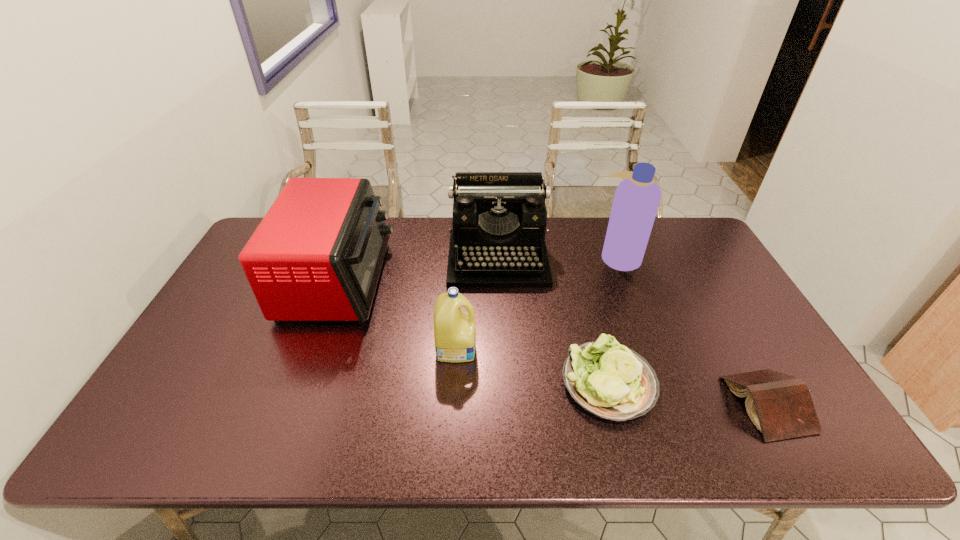
The image size is (960, 540). I want to click on the tallest object, so click(x=636, y=201).

Where is `typewriter`? The height and width of the screenshot is (540, 960). typewriter is located at coordinates (499, 220).

I want to click on the leftmost object, so click(317, 254).

Where is `the fourth tallest object`? This screenshot has height=540, width=960. the fourth tallest object is located at coordinates (454, 330).

The image size is (960, 540). What are the coordinates of `the fifth tallest object` in the screenshot? It's located at (607, 379).

I want to click on book, so click(780, 406).

Locate an element on the screen. This screenshot has height=540, width=960. the shortest object is located at coordinates (780, 406).

Locate an element on the screen. blank area located on the front of the shampoo is located at coordinates (638, 309).

You are a GUI agent. You are given a task and a screenshot of the screen. Output one action in this format:
    pyautogui.click(x=<x>, y=<y>)
    Task: Click on the vacant space located 0.260m on the typing side of the typewriter
    The height and width of the screenshot is (540, 960).
    Given the screenshot: What is the action you would take?
    pyautogui.click(x=503, y=355)

Locate an element on the screen. The height and width of the screenshot is (540, 960). vacant space located 0.150m on the front-facing side of the leftmost object is located at coordinates (436, 280).